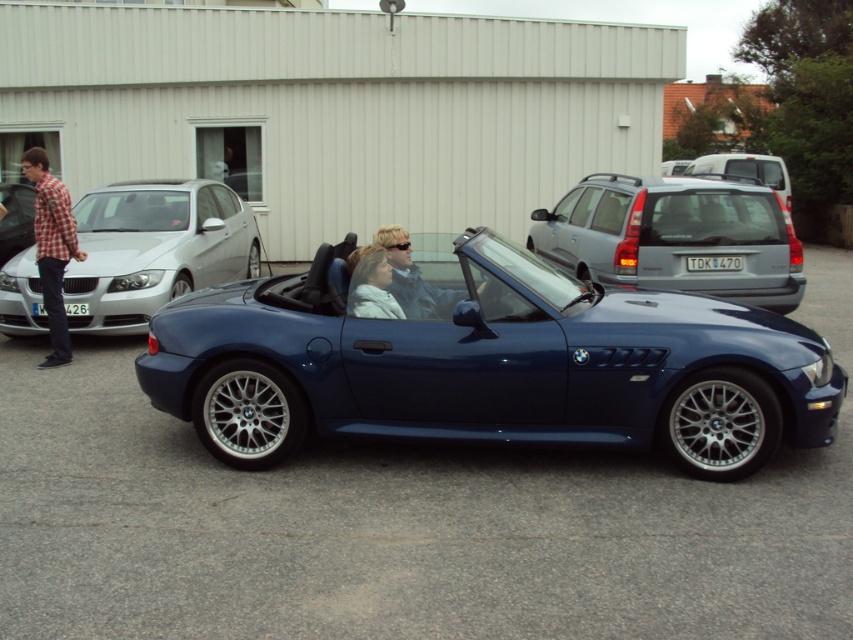
Looking at this image, you are a photographer trying to capture the shiny blue convertible at center without any obstructions. The checkered fabric shirt at left is currently blocking your view. Can you move to the right side of the convertible to take the photo?

The shiny blue convertible at center is positioned under the checkered fabric shirt at left, so moving to the right side of the shiny blue convertible at center would allow you to avoid the obstruction from the checkered fabric shirt at left and take the photo without any issues.